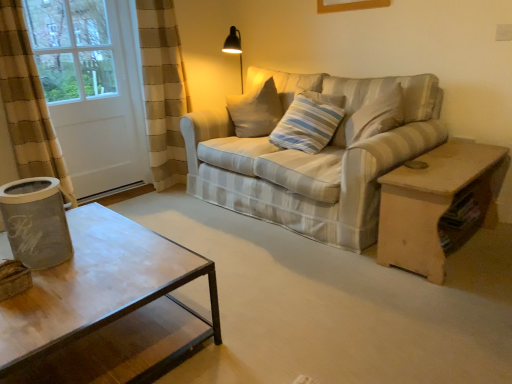
Question: Considering the relative sizes of striped fabric couch at center and striped fabric pillow at center in the image provided, is striped fabric couch at center smaller than striped fabric pillow at center?

Choices:
 (A) no
 (B) yes

Answer: (A)

Question: Can you confirm if striped fabric couch at center is taller than striped fabric pillow at center?

Choices:
 (A) no
 (B) yes

Answer: (B)

Question: Does striped fabric couch at center appear on the left side of striped fabric pillow at center?

Choices:
 (A) no
 (B) yes

Answer: (B)

Question: From a real-world perspective, is striped fabric couch at center located beneath striped fabric pillow at center?

Choices:
 (A) yes
 (B) no

Answer: (A)

Question: Is the depth of striped fabric couch at center greater than that of striped fabric pillow at center?

Choices:
 (A) no
 (B) yes

Answer: (A)

Question: Is point (468, 172) positioned closer to the camera than point (305, 165)?

Choices:
 (A) closer
 (B) farther

Answer: (A)

Question: Based on their positions, is light brown wooden table at right located to the left or right of striped fabric couch at center?

Choices:
 (A) left
 (B) right

Answer: (B)

Question: In terms of size, does light brown wooden table at right appear bigger or smaller than striped fabric couch at center?

Choices:
 (A) small
 (B) big

Answer: (A)

Question: Considering their positions, is light brown wooden table at right located in front of or behind striped fabric couch at center?

Choices:
 (A) behind
 (B) front

Answer: (B)

Question: From the image's perspective, is white matte screen door at left above or below striped fabric couch at center?

Choices:
 (A) below
 (B) above

Answer: (B)

Question: Is white matte screen door at left inside or outside of striped fabric couch at center?

Choices:
 (A) inside
 (B) outside

Answer: (B)

Question: In terms of height, does white matte screen door at left look taller or shorter compared to striped fabric couch at center?

Choices:
 (A) tall
 (B) short

Answer: (A)

Question: In the image, is white matte screen door at left on the left side or the right side of striped fabric couch at center?

Choices:
 (A) left
 (B) right

Answer: (A)

Question: Is striped fabric couch at center in front of or behind striped fabric pillow at center in the image?

Choices:
 (A) front
 (B) behind

Answer: (A)

Question: Looking at the image, does striped fabric couch at center seem bigger or smaller compared to striped fabric pillow at center?

Choices:
 (A) small
 (B) big

Answer: (B)